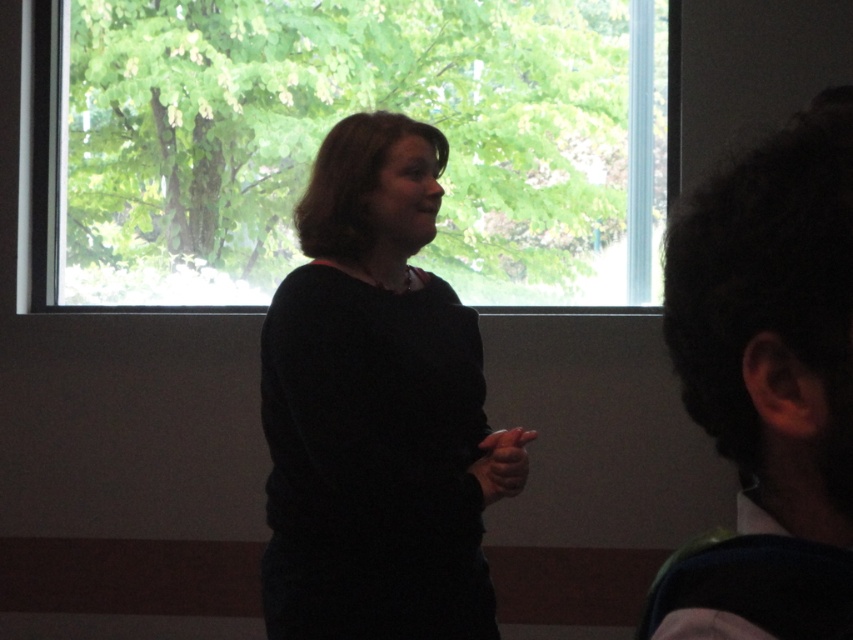
Question: Considering the real-world distances, which object is farthest from the black matte sweater at center?

Choices:
 (A) transparent glass window at upper center
 (B) dark curly hair at right

Answer: (A)

Question: Is black matte sweater at center bigger than dark curly hair at right?

Choices:
 (A) yes
 (B) no

Answer: (A)

Question: Among these points, which one is farthest from the camera?

Choices:
 (A) (422, 317)
 (B) (809, 124)

Answer: (A)

Question: Which point is closer to the camera taking this photo?

Choices:
 (A) (408, 609)
 (B) (699, 406)
 (C) (212, 168)

Answer: (B)

Question: Does black matte sweater at center have a greater width compared to dark curly hair at right?

Choices:
 (A) no
 (B) yes

Answer: (B)

Question: Is the position of black matte sweater at center more distant than that of dark curly hair at right?

Choices:
 (A) no
 (B) yes

Answer: (B)